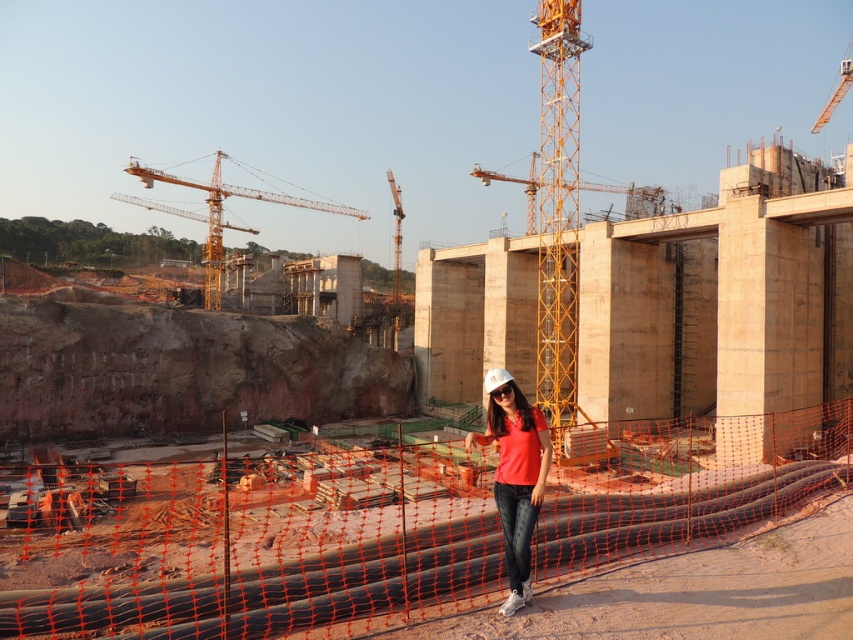
You are a drone operator tasked with capturing aerial footage of the construction site. Your drone must fly from the yellow metallic crane at upper left to the matte red shirt at center without getting too close to any workers. What is the minimum safe distance your drone should maintain during this flight?

The minimum safe distance your drone should maintain is 120.91 meters between the yellow metallic crane at upper left and the matte red shirt at center to ensure it doesn